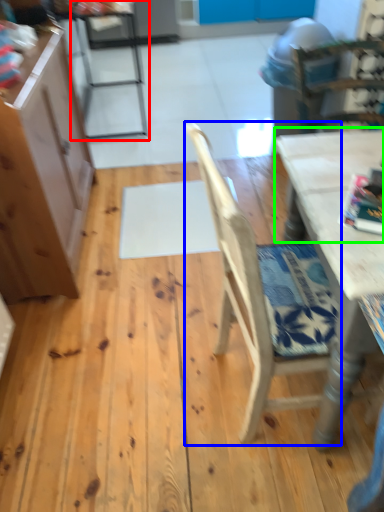
Question: Estimate the real-world distances between objects in this image. Which object is farther from chair (highlighted by a red box), chair (highlighted by a blue box) or table top (highlighted by a green box)?

Choices:
 (A) chair
 (B) table top

Answer: (A)